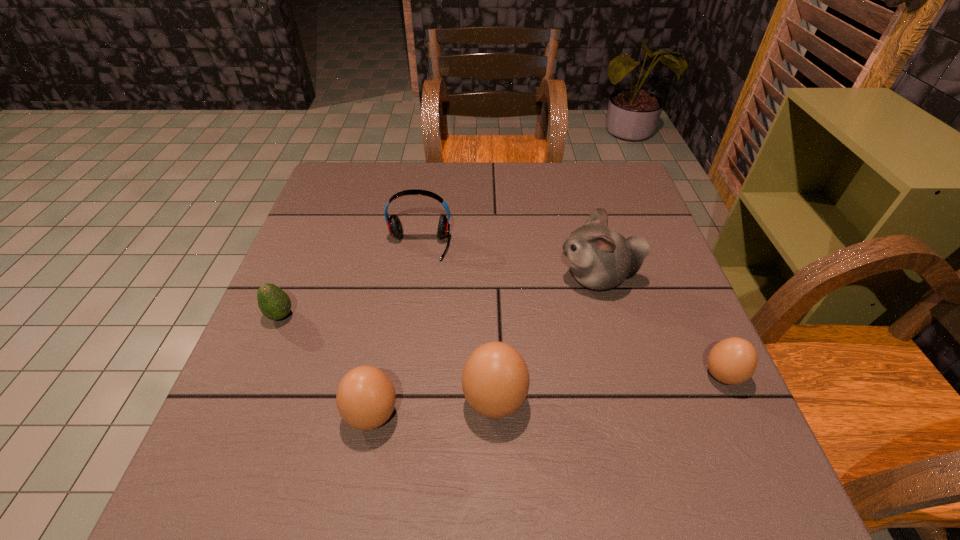
Identify the location of the second shortest boiled egg. The image size is (960, 540). (365, 398).

This screenshot has width=960, height=540. Identify the location of the second boiled egg from left to right. (495, 380).

The image size is (960, 540). What are the coordinates of `the tallest boiled egg` in the screenshot? It's located at (495, 380).

You are a GUI agent. You are given a task and a screenshot of the screen. Output one action in this format:
    pyautogui.click(x=<x>, y=<y>)
    Task: Click on the rightmost boiled egg
    
    Given the screenshot: What is the action you would take?
    pyautogui.click(x=732, y=361)

You are a GUI agent. You are given a task and a screenshot of the screen. Output one action in this format:
    pyautogui.click(x=<x>, y=<y>)
    Task: Click on the rightmost object
    The image size is (960, 540).
    Given the screenshot: What is the action you would take?
    pyautogui.click(x=732, y=361)

Identify the location of hamster. (600, 258).

Find the location of a particular element. This screenshot has height=540, width=960. the third farthest object is located at coordinates (274, 303).

Locate an element on the screen. This screenshot has width=960, height=540. the leftmost object is located at coordinates (274, 303).

Locate an element on the screen. headset is located at coordinates 393,222.

At what (x,y) coordinates should I click in order to perform the action: click on vacant space positioned 0.090m on the back of the second tallest boiled egg. Please return your answer as a coordinate pair (x, y). This screenshot has width=960, height=540. Looking at the image, I should click on (384, 350).